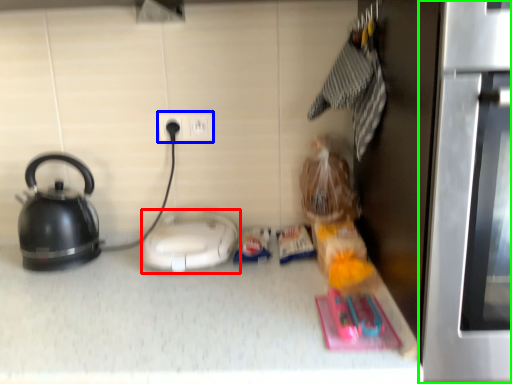
Question: Which is farther away from appliance (highlighted by a red box)? electric outlet (highlighted by a blue box) or oven (highlighted by a green box)?

Choices:
 (A) electric outlet
 (B) oven

Answer: (B)